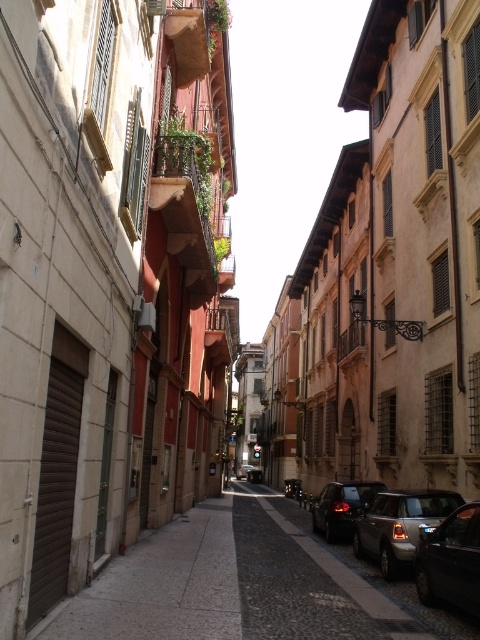
Question: Which of these objects is positioned closest to the shiny silver car at lower right?

Choices:
 (A) shiny black car at lower right
 (B) shiny black car at center
 (C) cobblestone pavement at center

Answer: (A)

Question: Does cobblestone pavement at center appear on the right side of shiny black car at center?

Choices:
 (A) no
 (B) yes

Answer: (A)

Question: In this image, where is cobblestone pavement at center located relative to shiny black car at center?

Choices:
 (A) below
 (B) above

Answer: (B)

Question: Which point is farther to the camera?

Choices:
 (A) cobblestone pavement at center
 (B) shiny silver car at lower right
 (C) shiny black car at lower right

Answer: (B)

Question: Does cobblestone pavement at center appear on the left side of shiny black car at lower right?

Choices:
 (A) no
 (B) yes

Answer: (B)

Question: Which point is farther to the camera?

Choices:
 (A) (405, 540)
 (B) (468, 504)
 (C) (248, 464)
 (D) (252, 609)

Answer: (C)